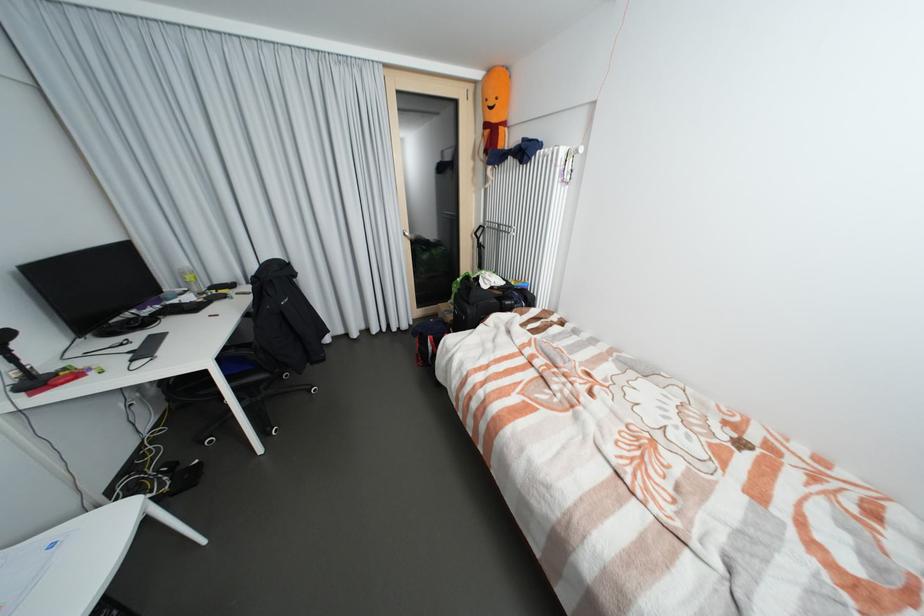
Find where to grasp the joystick handle. Please return your answer as a coordinate pair (x, y).

(6, 339)